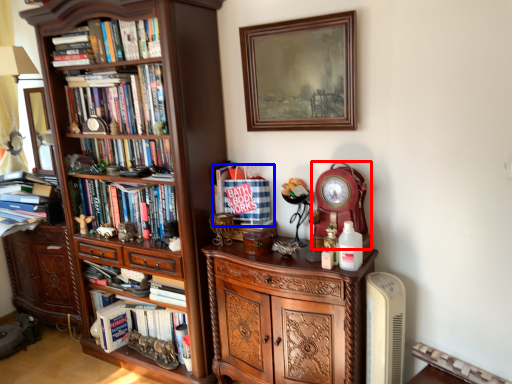
Question: Which object is further to the camera taking this photo, clock (highlighted by a red box) or book (highlighted by a blue box)?

Choices:
 (A) clock
 (B) book

Answer: (B)